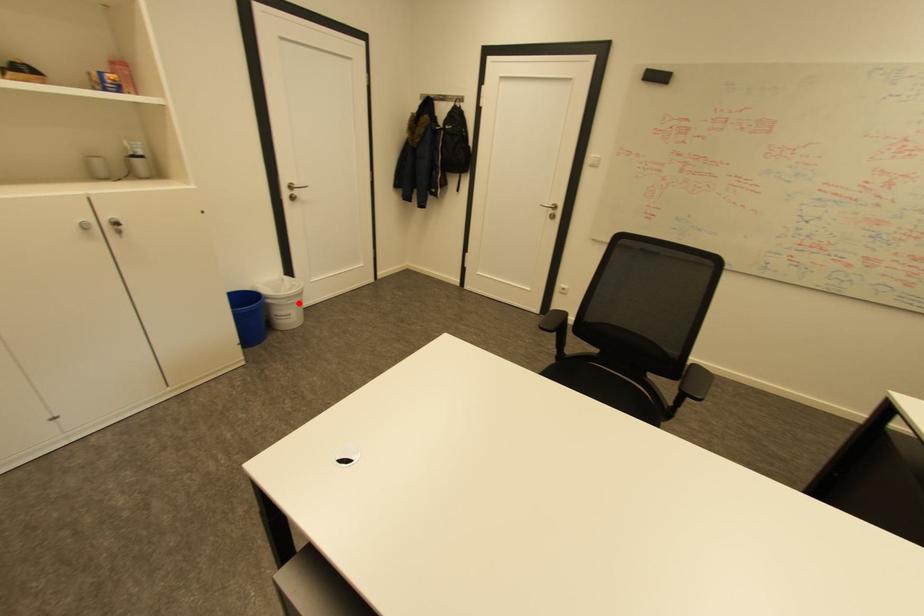
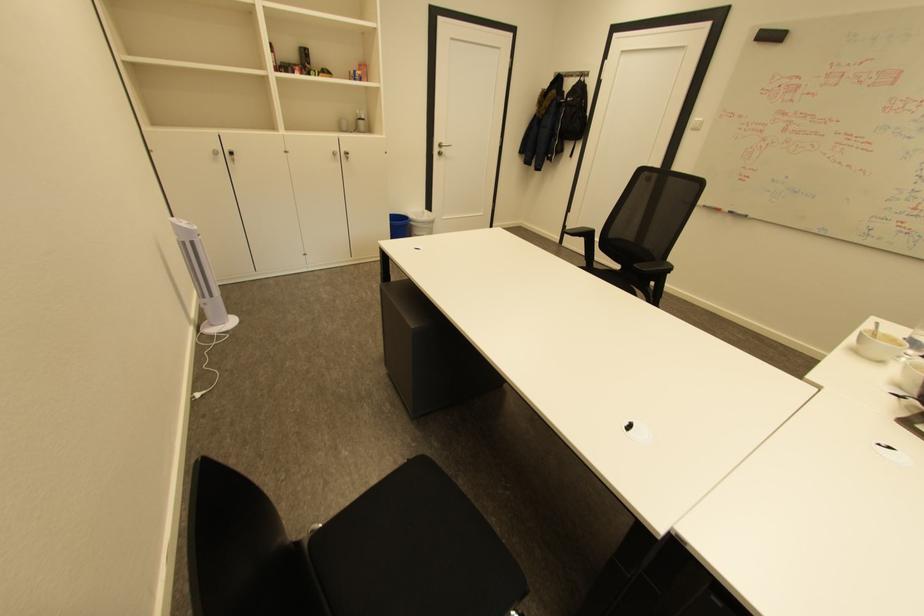
Question: I am providing you with two images of the same scene from different viewpoints. In image1, a red point is highlighted. Considering the same 3D point in image2, which of the following is correct?

Choices:
 (A) It is closer
 (B) It is farther

Answer: (B)